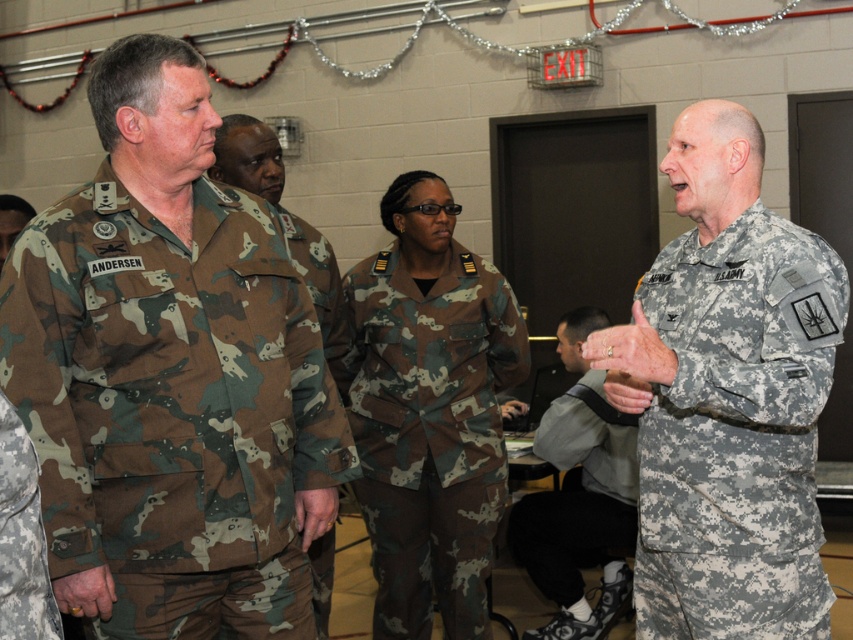
Question: Which of these objects is positioned farthest from the camouflage fabric uniform at left?

Choices:
 (A) camo fabric uniform at center
 (B) camo fabric uniform at left
 (C) camouflage fabric uniform at right
 (D) camo uniform at center

Answer: (A)

Question: Where is camouflage fabric uniform at right located in relation to camo fabric uniform at center in the image?

Choices:
 (A) right
 (B) left

Answer: (A)

Question: Estimate the real-world distances between objects in this image. Which object is farther from the camo uniform at center?

Choices:
 (A) camo fabric uniform at center
 (B) gray fabric uniform at lower right
 (C) camouflage fabric uniform at left

Answer: (C)

Question: Does camo fabric uniform at left appear over camouflage fabric uniform at left?

Choices:
 (A) no
 (B) yes

Answer: (B)

Question: Which point appears closest to the camera in this image?

Choices:
 (A) (25, 636)
 (B) (656, 586)
 (C) (445, 520)
 (D) (270, 193)

Answer: (A)

Question: Can you confirm if camouflage fabric uniform at right is positioned to the left of camo fabric uniform at center?

Choices:
 (A) no
 (B) yes

Answer: (A)